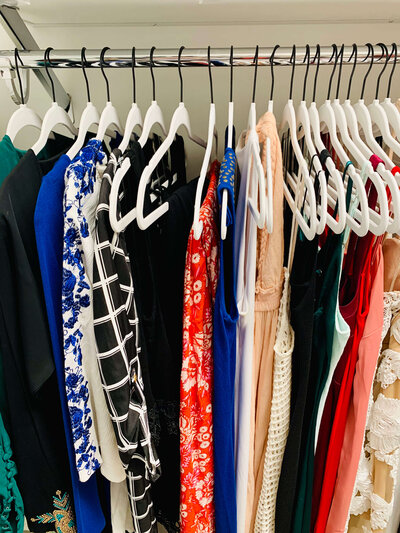
This screenshot has height=533, width=400. In order to click on clothing rack in this screenshot , I will do `click(165, 59)`.